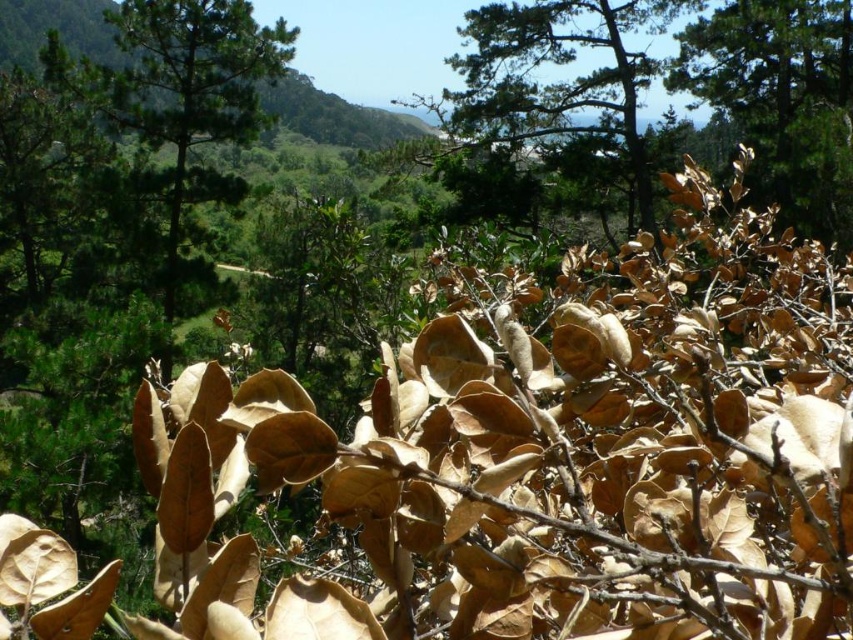
Question: Is green textured pine tree at upper center to the left of brown matte leaves at upper right from the viewer's perspective?

Choices:
 (A) no
 (B) yes

Answer: (B)

Question: Which object is closer to the camera taking this photo?

Choices:
 (A) green textured pine tree at upper center
 (B) brown matte leaves at upper right

Answer: (B)

Question: Is green textured pine tree at upper center positioned behind brown matte leaves at upper right?

Choices:
 (A) no
 (B) yes

Answer: (B)

Question: Is green textured pine tree at upper center closer to the viewer compared to brown matte leaves at upper right?

Choices:
 (A) yes
 (B) no

Answer: (B)

Question: Which point is closer to the camera taking this photo?

Choices:
 (A) (802, 225)
 (B) (628, 180)

Answer: (A)